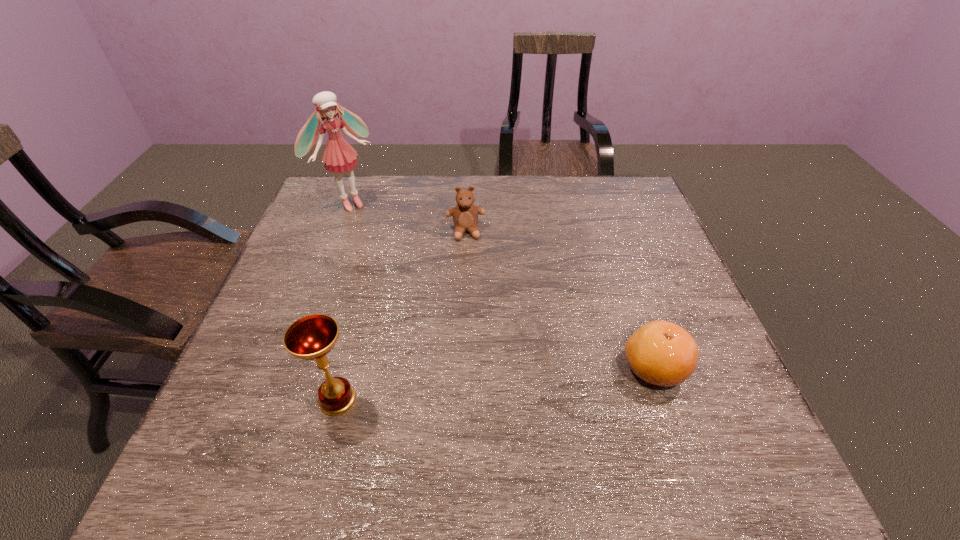
You are a GUI agent. You are given a task and a screenshot of the screen. Output one action in this format:
    pyautogui.click(x=<x>, y=<y>)
    Task: Click on the chalice
    
    Given the screenshot: What is the action you would take?
    pyautogui.click(x=312, y=337)

Identify the location of the shortest object. The image size is (960, 540). (661, 353).

This screenshot has width=960, height=540. I want to click on clementine, so click(x=661, y=353).

Where is `teddy bear`? This screenshot has width=960, height=540. teddy bear is located at coordinates (465, 215).

You are a GUI agent. You are given a task and a screenshot of the screen. Output one action in this format:
    pyautogui.click(x=<x>, y=<y>)
    Task: Click on the second object from right to left
    The width and height of the screenshot is (960, 540).
    Given the screenshot: What is the action you would take?
    pyautogui.click(x=465, y=215)

At what (x,y) coordinates should I click in order to perform the action: click on the farthest object. Please return your answer as a coordinate pair (x, y). The height and width of the screenshot is (540, 960). Looking at the image, I should click on (339, 156).

Where is `the tallest object`? The height and width of the screenshot is (540, 960). the tallest object is located at coordinates (339, 156).

In order to click on free space located on the right of the chalice in this screenshot , I will do 405,400.

Identify the location of vacant space located 0.130m on the left of the clementine. (561, 368).

Where is `vacant space situated 0.290m on the front-facing side of the teddy bear`? Image resolution: width=960 pixels, height=540 pixels. vacant space situated 0.290m on the front-facing side of the teddy bear is located at coordinates (477, 321).